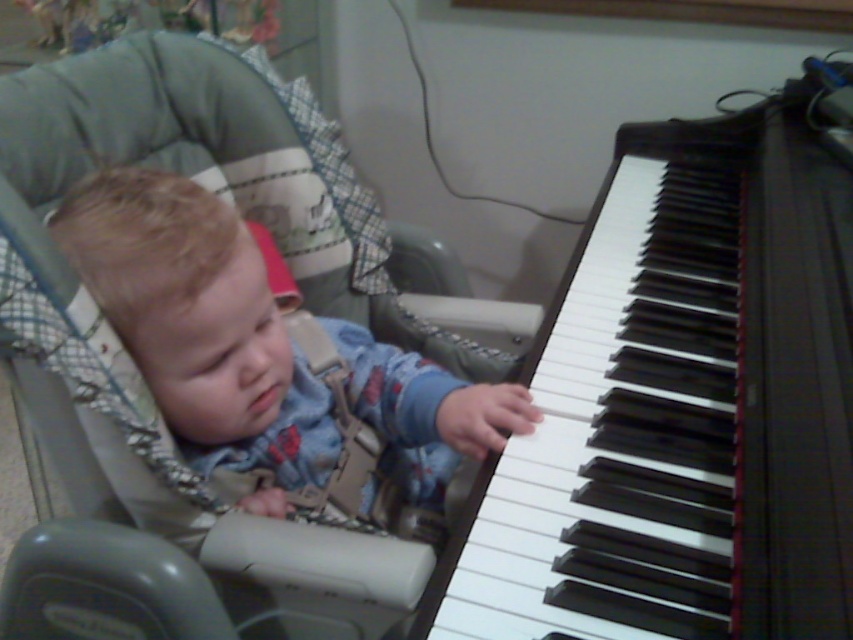
You are a parent observing your child in the scene. You want to ensure the piano keys are safe for your child to touch. Considering the height difference between the white glossy piano keys at right and the blue denim jumpsuit at center, can your child easily reach the piano keys?

The white glossy piano keys at right are taller than the blue denim jumpsuit at center, so the child wearing the blue denim jumpsuit at center can easily reach the piano keys since they are positioned higher than the child.

You are a parent observing your child in the scene. You notice the white glossy piano keys at right and the blue denim jumpsuit at center. Which object takes up more space in the image?

The white glossy piano keys at right takes up more space in the image than the blue denim jumpsuit at center because it is larger in size.